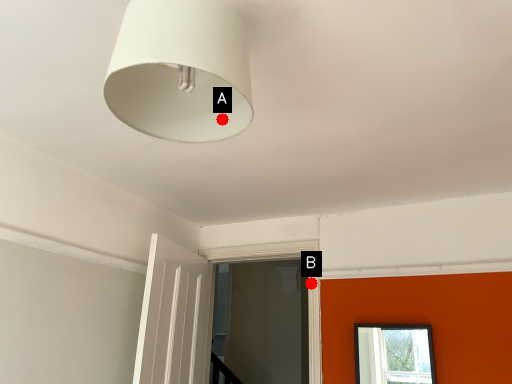
Question: Two points are circled on the image, labeled by A and B beside each circle. Which of the following is the farthest from the observer?

Choices:
 (A) A is further
 (B) B is further

Answer: (B)